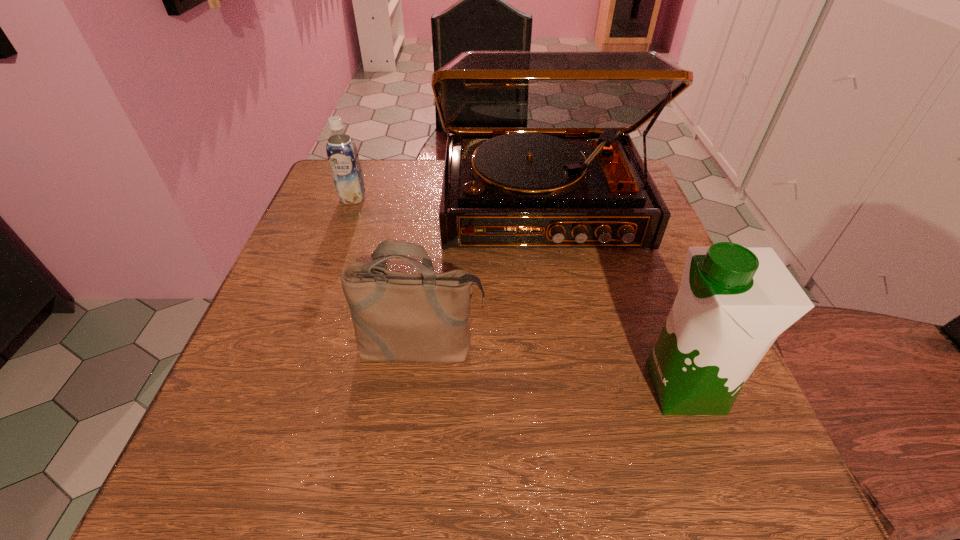
This screenshot has width=960, height=540. In order to click on the tallest object in this screenshot , I will do `click(538, 155)`.

Locate an element on the screen. The height and width of the screenshot is (540, 960). the taller soya milk is located at coordinates (733, 302).

Locate an element on the screen. This screenshot has height=540, width=960. the right soya milk is located at coordinates (733, 302).

Identify the location of shoulder bag. (407, 317).

The height and width of the screenshot is (540, 960). I want to click on the leftmost object, so click(x=342, y=154).

The width and height of the screenshot is (960, 540). In order to click on the shorter soya milk in this screenshot , I will do `click(342, 154)`.

The width and height of the screenshot is (960, 540). I want to click on free space located 0.390m on the front-facing side of the tallest object, so click(x=582, y=437).

Locate an element on the screen. blank area located 0.340m on the front-facing side of the nearer soya milk is located at coordinates (430, 388).

Locate an element on the screen. The height and width of the screenshot is (540, 960). free point located 0.240m on the front-facing side of the nearer soya milk is located at coordinates (493, 388).

Find the location of a particular element. free space located on the front-facing side of the nearer soya milk is located at coordinates (488, 388).